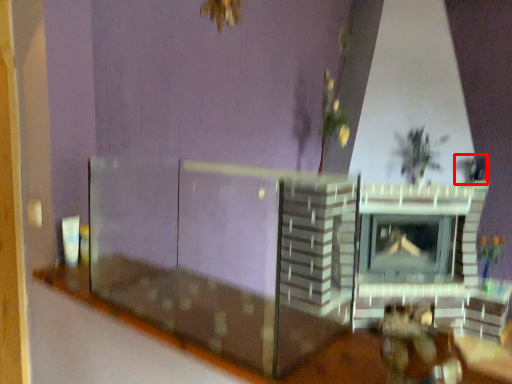
Question: Considering the relative positions of plant (annotated by the red box) and table in the image provided, where is plant (annotated by the red box) located with respect to the staircase?

Choices:
 (A) left
 (B) right

Answer: (B)